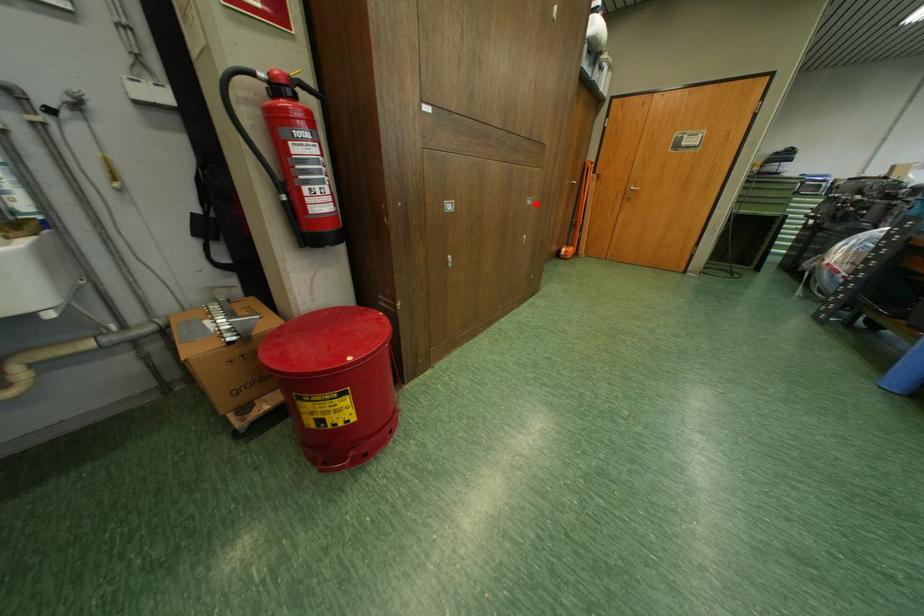
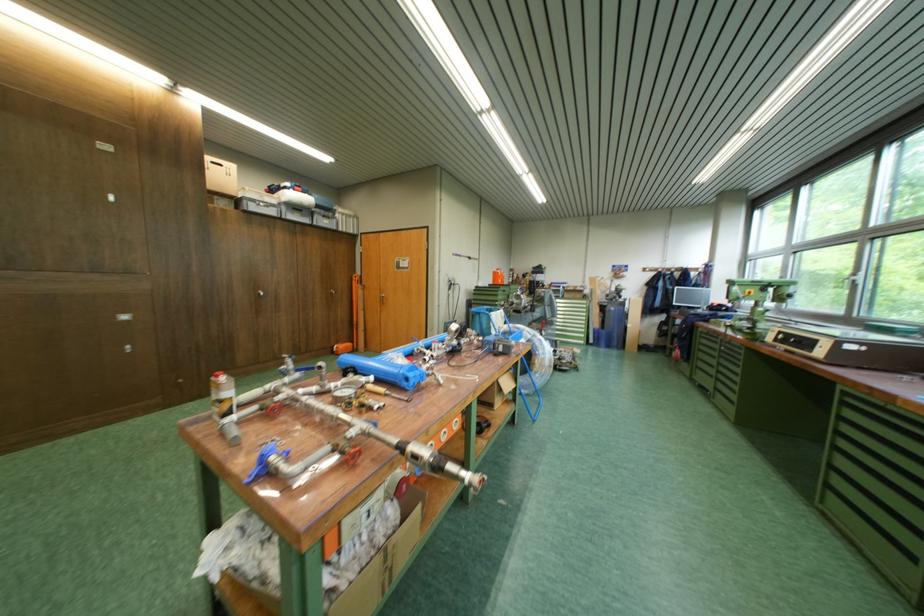
Find the pixel in the second image that matches the highlighted location in the first image.

(127, 321)